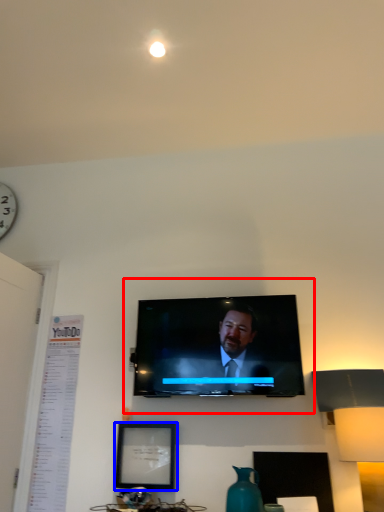
Question: Which object is further to the camera taking this photo, tv show (highlighted by a red box) or picture frame (highlighted by a blue box)?

Choices:
 (A) tv show
 (B) picture frame

Answer: (B)